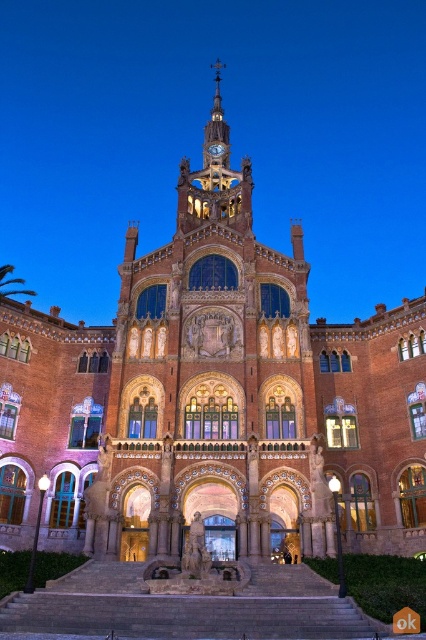
Is golden ornate clock tower at upper center above gold metallic clock at upper center?

Correct, golden ornate clock tower at upper center is located above gold metallic clock at upper center.

In the scene shown: Which is more to the left, golden ornate clock tower at upper center or gold metallic clock at upper center?

Positioned to the left is golden ornate clock tower at upper center.

Does point (250, 209) lie behind point (218, 154)?

No, it is in front of (218, 154).

This screenshot has height=640, width=426. What are the coordinates of `golden ornate clock tower at upper center` in the screenshot? It's located at (215, 179).